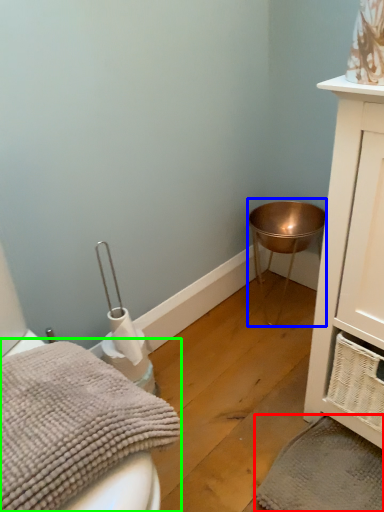
Question: Which object is the closest to the bath towel (highlighted by a red box)? Choose among these: changing table (highlighted by a blue box) or bath towel (highlighted by a green box).

Choices:
 (A) changing table
 (B) bath towel

Answer: (B)